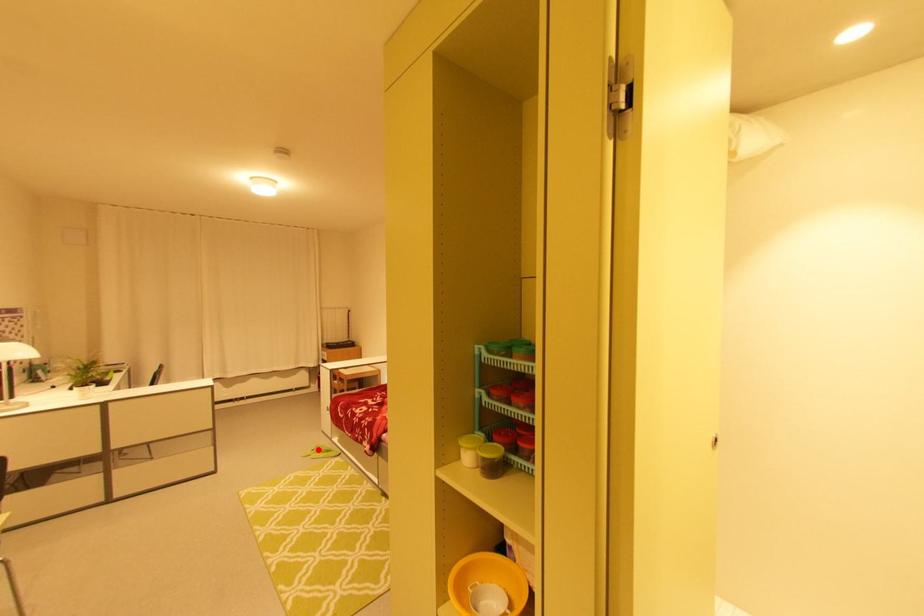
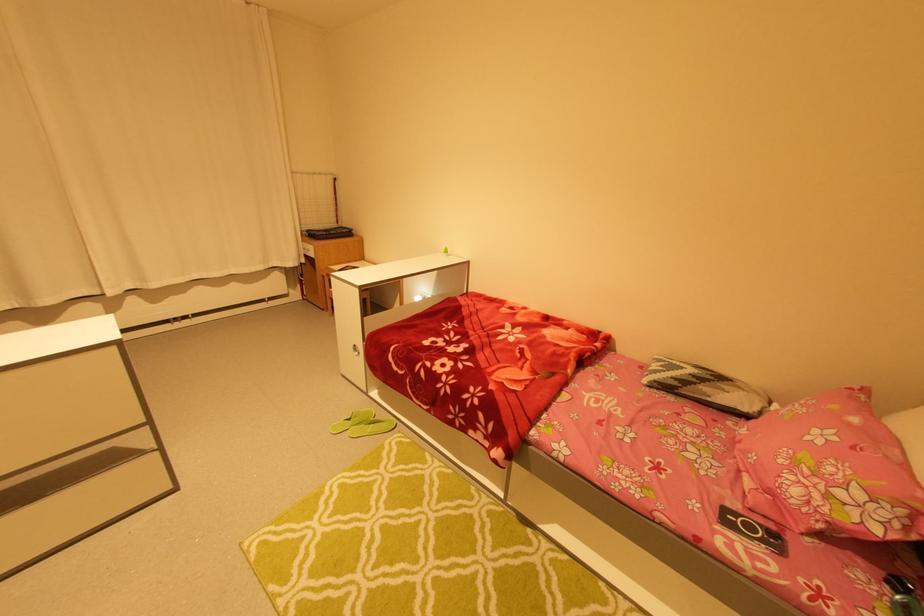
Locate, in the second image, the point that corresponds to the highlighted location in the first image.

(354, 419)